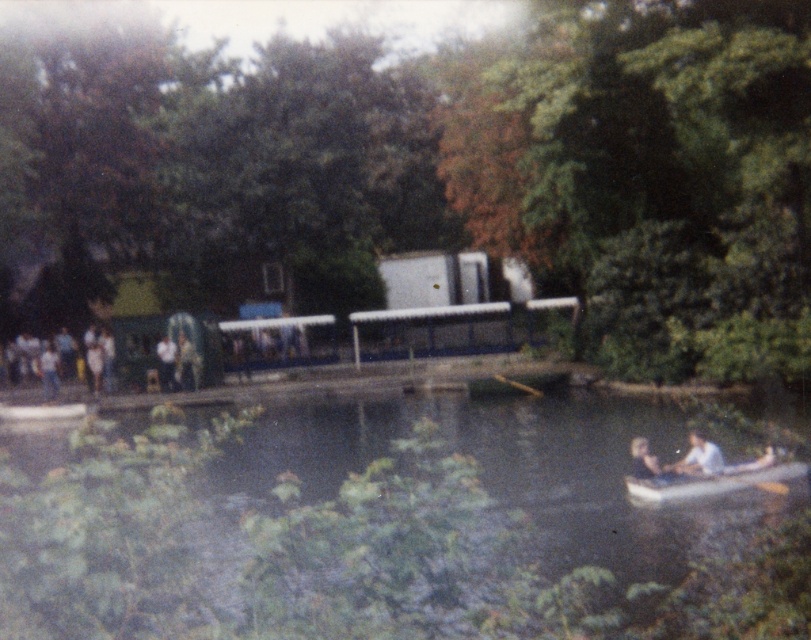
Does green leafy river at lower center have a smaller size compared to wooden paddle at lower right?

Incorrect, green leafy river at lower center is not smaller in size than wooden paddle at lower right.

What do you see at coordinates (367, 525) in the screenshot? The height and width of the screenshot is (640, 811). I see `green leafy river at lower center` at bounding box center [367, 525].

Where is `green leafy river at lower center`? The image size is (811, 640). green leafy river at lower center is located at coordinates (367, 525).

Can you confirm if green leafy river at lower center is taller than wooden paddle at center?

Correct, green leafy river at lower center is much taller as wooden paddle at center.

Find the location of a particular element. This screenshot has height=640, width=811. green leafy river at lower center is located at coordinates (367, 525).

Between point (707, 477) and point (509, 378), which one is positioned in front?

Point (707, 477)

Consider the image. Between wooden paddle at lower right and wooden paddle at center, which one has more height?

Standing taller between the two is wooden paddle at center.

Does point (676, 484) come closer to viewer compared to point (513, 385)?

Yes, point (676, 484) is closer to viewer.

This screenshot has height=640, width=811. In order to click on wooden paddle at lower right in this screenshot , I will do `click(732, 481)`.